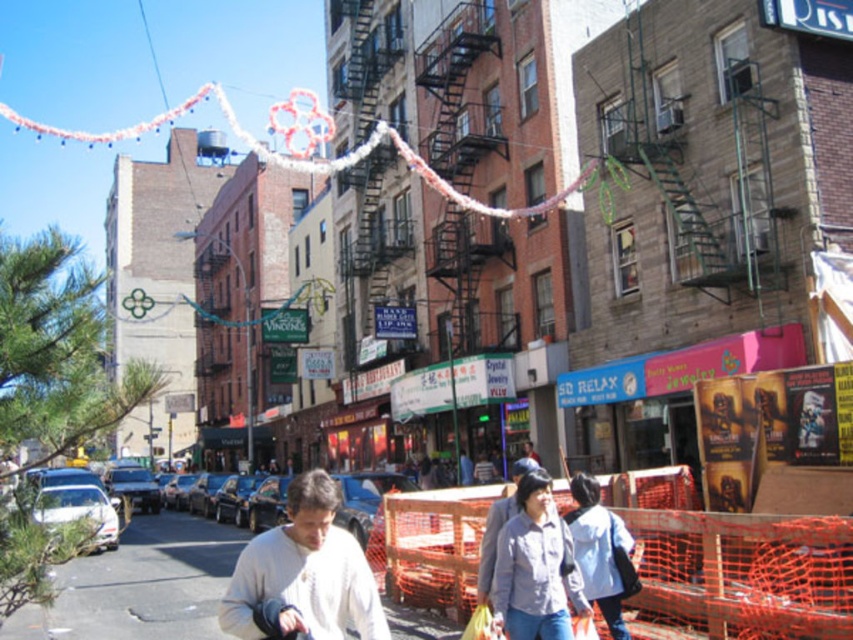
Question: Considering the real-world distances, which object is closest to the white matte jacket at lower right?

Choices:
 (A) white fabric banner at upper center
 (B) green metal fire escape at upper right

Answer: (B)

Question: Which point is closer to the camera taking this photo?

Choices:
 (A) (341, 556)
 (B) (619, 637)

Answer: (A)

Question: Is green metal fire escape at upper right below white fabric banner at upper center?

Choices:
 (A) no
 (B) yes

Answer: (B)

Question: Which point appears farthest from the camera in this image?

Choices:
 (A) (131, 131)
 (B) (219, 621)
 (C) (578, 532)

Answer: (A)

Question: Is white matte sweater at center smaller than white fabric banner at upper center?

Choices:
 (A) yes
 (B) no

Answer: (A)

Question: Does green metal fire escape at upper right have a smaller size compared to white matte jacket at lower right?

Choices:
 (A) no
 (B) yes

Answer: (A)